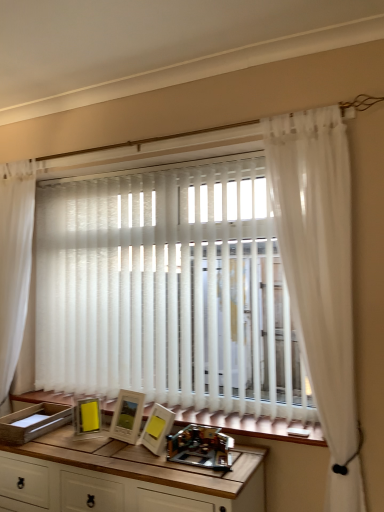
What are the coordinates of `free space above wooden table at center (from a real-world perspective)` in the screenshot? It's located at (116, 450).